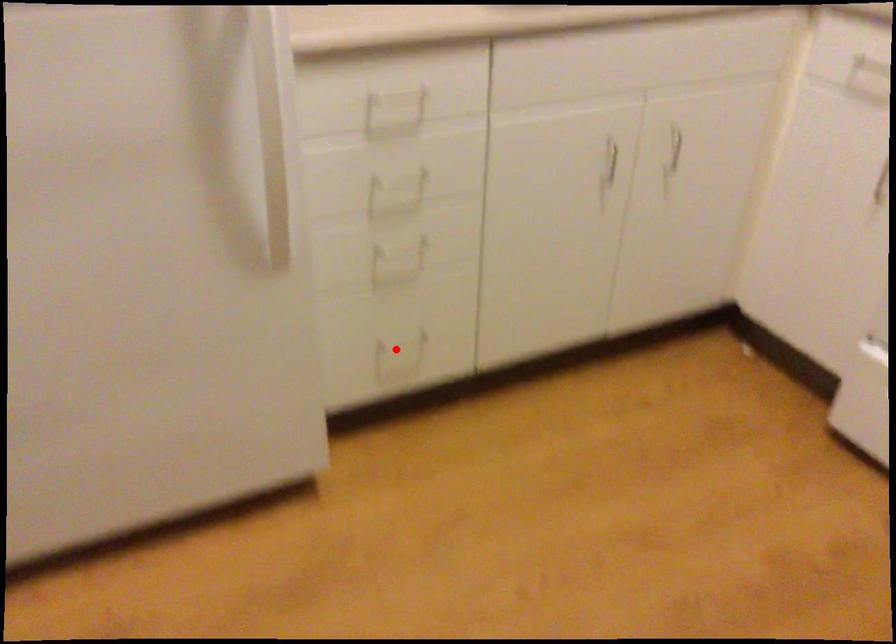
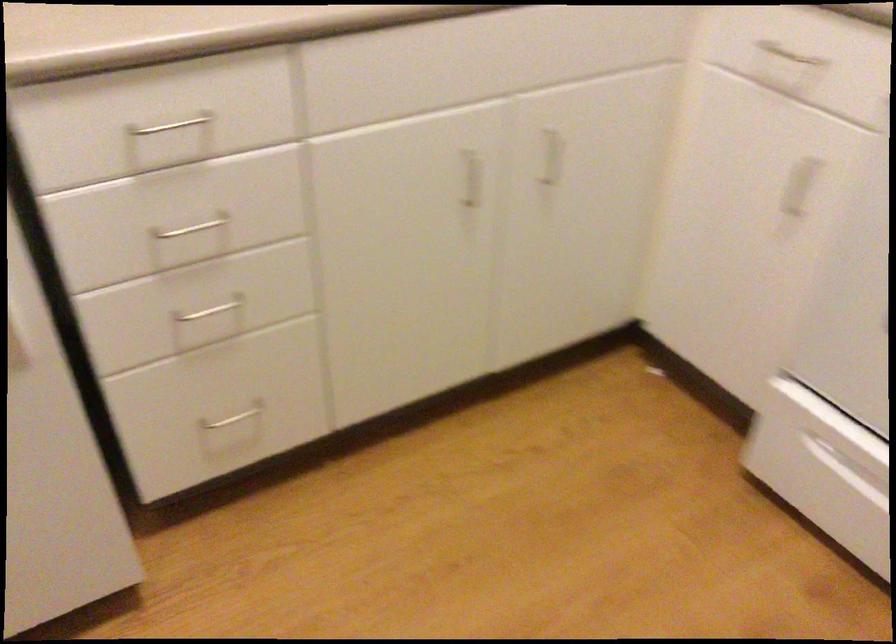
The point at the highlighted location is marked in the first image. Where is the corresponding point in the second image?

(231, 419)